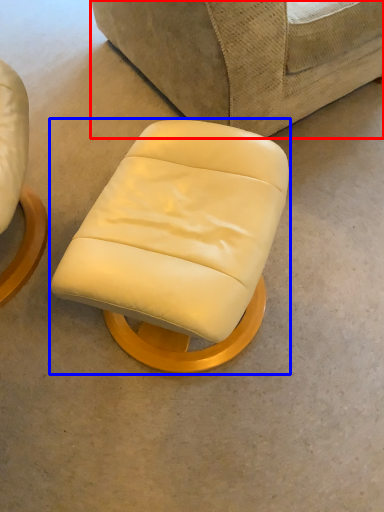
Question: Among these objects, which one is nearest to the camera, studio couch (highlighted by a red box) or chair (highlighted by a blue box)?

Choices:
 (A) studio couch
 (B) chair

Answer: (B)